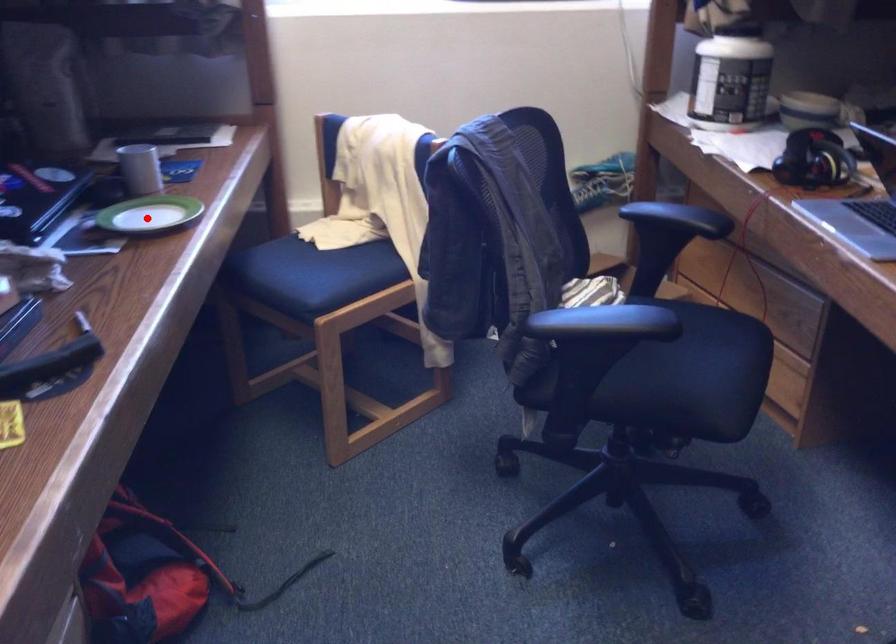
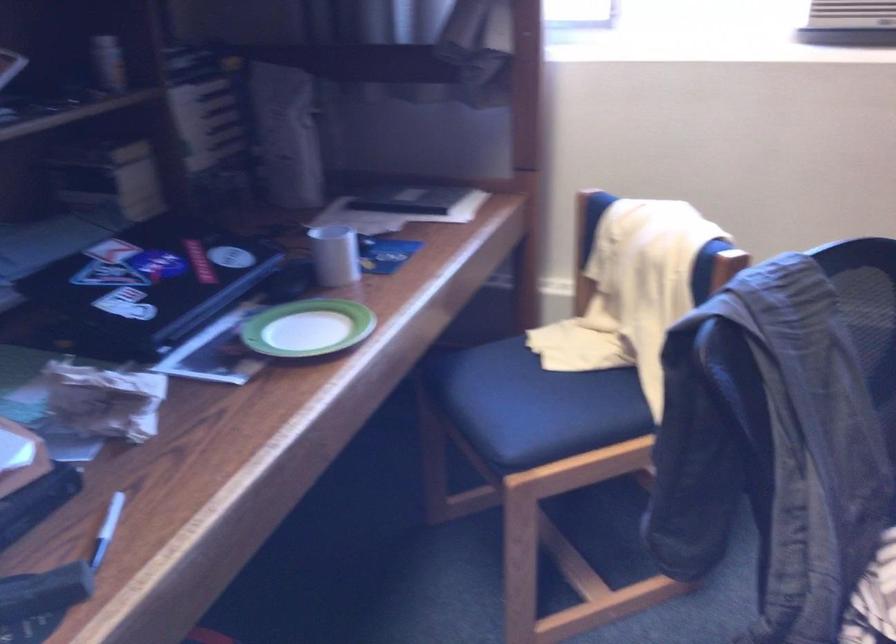
Question: I am providing you with two images of the same scene from different viewpoints. In image1, a red point is highlighted. Considering the same 3D point in image2, which of the following is correct?

Choices:
 (A) It is closer
 (B) It is farther

Answer: (A)